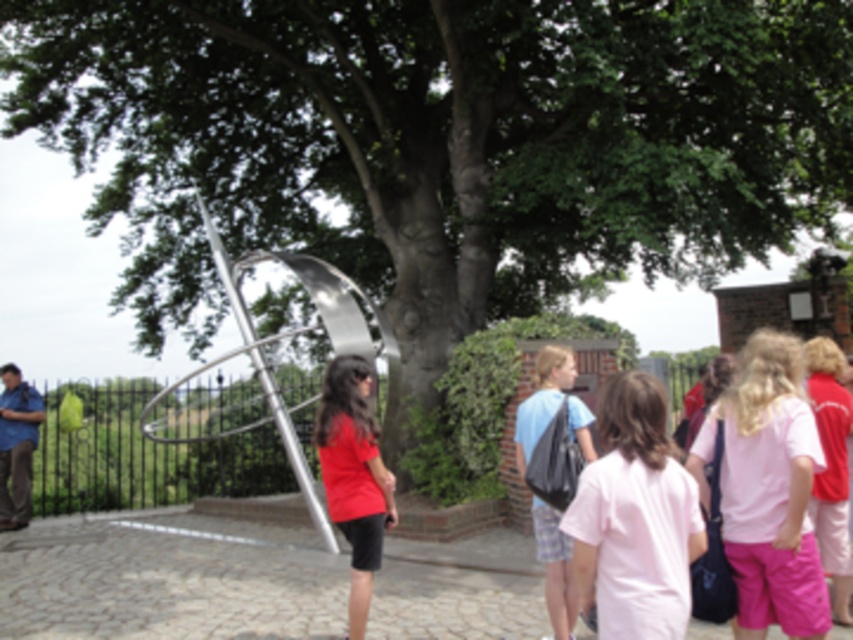
Question: Which point appears farthest from the camera in this image?

Choices:
 (A) (653, 593)
 (B) (207, 436)
 (C) (340, 522)

Answer: (B)

Question: Which is nearer to the matte red shirt at center?

Choices:
 (A) pink cotton shirt at center
 (B) shiny metallic sculpture at center

Answer: (A)

Question: Is pink cotton shirt at center above matte red shirt at center?

Choices:
 (A) no
 (B) yes

Answer: (B)

Question: Considering the relative positions of shiny metallic sculpture at center and matte red shirt at center in the image provided, where is shiny metallic sculpture at center located with respect to matte red shirt at center?

Choices:
 (A) left
 (B) right

Answer: (A)

Question: Is pink cotton shirt at center bigger than matte red shirt at center?

Choices:
 (A) no
 (B) yes

Answer: (A)

Question: Which object is the farthest from the matte red shirt at center?

Choices:
 (A) shiny metallic sculpture at center
 (B) pink cotton shirt at center

Answer: (A)